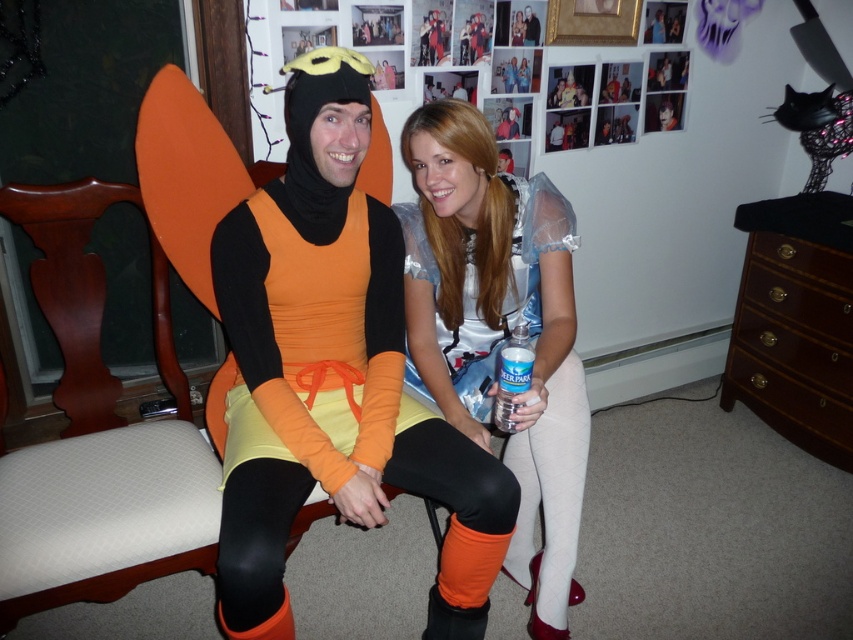
Question: Which of these objects is positioned closest to the matte orange costume at center?

Choices:
 (A) brown wood dresser at right
 (B) matte black costume at center

Answer: (B)

Question: Estimate the real-world distances between objects in this image. Which object is closer to the matte silver dress at center?

Choices:
 (A) brown wood dresser at right
 (B) matte black costume at center
 (C) matte orange costume at center

Answer: (C)

Question: Which object appears closest to the camera in this image?

Choices:
 (A) brown wood dresser at right
 (B) matte orange costume at center

Answer: (B)

Question: Is the position of matte orange costume at center less distant than that of matte black costume at center?

Choices:
 (A) no
 (B) yes

Answer: (B)

Question: Does brown wood dresser at right have a greater width compared to matte black costume at center?

Choices:
 (A) yes
 (B) no

Answer: (A)

Question: Considering the relative positions of matte orange costume at center and brown wood dresser at right in the image provided, where is matte orange costume at center located with respect to brown wood dresser at right?

Choices:
 (A) right
 (B) left

Answer: (B)